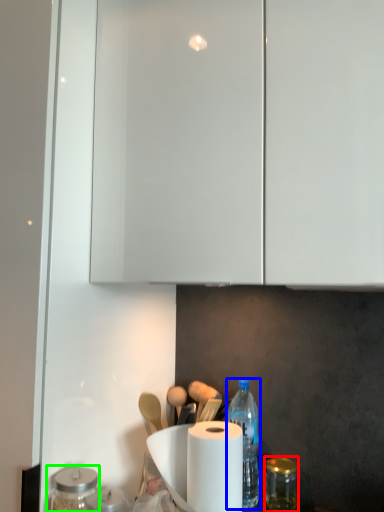
Question: Which object is the farthest from glass jar (highlighted by a red box)? Choose among these: bottle (highlighted by a blue box) or glass jar (highlighted by a green box).

Choices:
 (A) bottle
 (B) glass jar

Answer: (B)